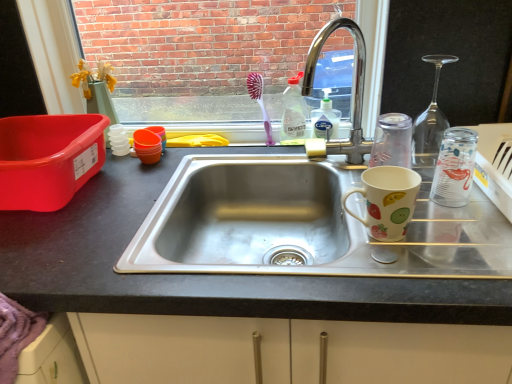
Question: In the image, is chrome/metallic faucet at upper center positioned in front of or behind transparent glass bottle at right, which is the first bottle in front-to-back order?

Choices:
 (A) behind
 (B) front

Answer: (B)

Question: In the image, is chrome/metallic faucet at upper center on the left side or the right side of transparent glass bottle at right, the second bottle positioned from the back?

Choices:
 (A) right
 (B) left

Answer: (B)

Question: Based on their relative distances, which object is nearer to the chrome/metallic faucet at upper center?

Choices:
 (A) translucent plastic bottle at upper center, the 1th bottle viewed from the back
 (B) transparent glass bottle at right, marked as the first bottle in a bottom-to-top arrangement
 (C) matte ceramic mug at right
 (D) matte black sink at center
 (E) pink plastic toothbrush at upper center

Answer: (A)

Question: Estimate the real-world distances between objects in this image. Which object is closer to the chrome/metallic faucet at upper center?

Choices:
 (A) matte black sink at center
 (B) transparent glass bottle at right, which is the first bottle in front-to-back order
 (C) pink plastic toothbrush at upper center
 (D) matte plastic container at left
 (E) matte ceramic mug at right

Answer: (C)